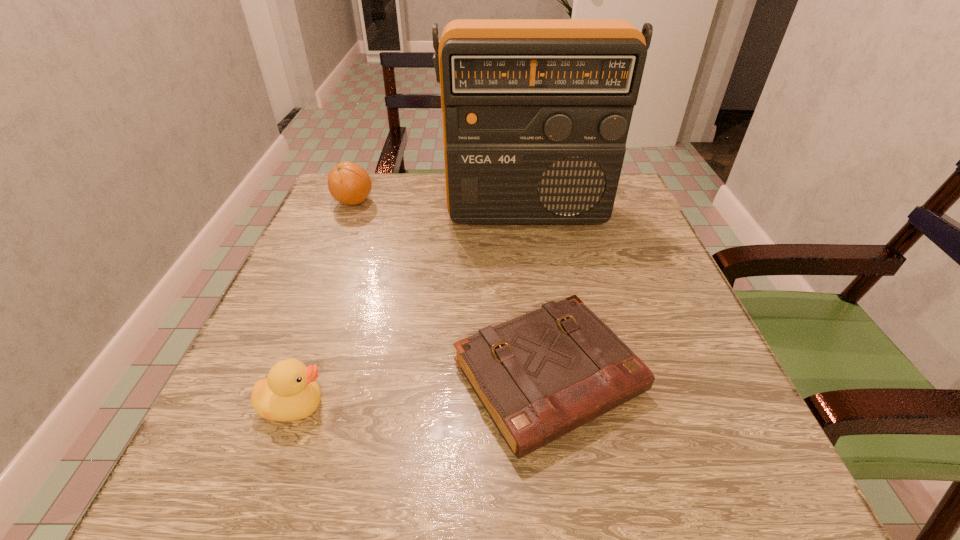
The width and height of the screenshot is (960, 540). What are the coordinates of `object that is at the near edge` in the screenshot? It's located at (541, 375).

Image resolution: width=960 pixels, height=540 pixels. What are the coordinates of `orange present at the left edge` in the screenshot? It's located at (348, 183).

Identify the location of duck present at the left edge. The width and height of the screenshot is (960, 540). (290, 392).

Where is `radio receiver situated at the right edge`? The image size is (960, 540). radio receiver situated at the right edge is located at coordinates (535, 112).

You are a GUI agent. You are given a task and a screenshot of the screen. Output one action in this format:
    pyautogui.click(x=<x>, y=<y>)
    Task: Click on the hardback book present at the right edge
    Image resolution: width=960 pixels, height=540 pixels.
    Given the screenshot: What is the action you would take?
    pyautogui.click(x=541, y=375)

Identify the location of object that is at the far left corner. (348, 183).

Locate an element on the screen. The height and width of the screenshot is (540, 960). object that is at the far right corner is located at coordinates (535, 112).

Where is `object positioned at the near right corner`? object positioned at the near right corner is located at coordinates (541, 375).

The height and width of the screenshot is (540, 960). In the image, there is a desktop. In order to click on vacant space at the near edge in this screenshot , I will do `click(583, 458)`.

The height and width of the screenshot is (540, 960). In order to click on vacant space at the right edge in this screenshot , I will do `click(626, 276)`.